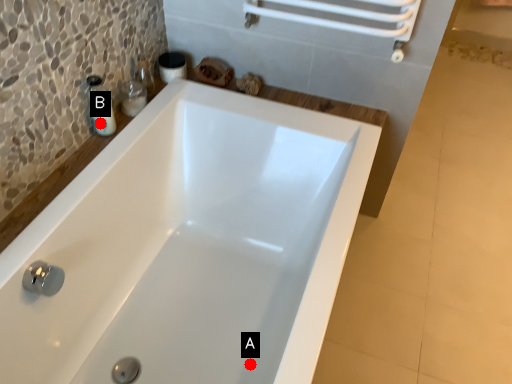
Question: Two points are circled on the image, labeled by A and B beside each circle. Which point appears farthest from the camera in this image?

Choices:
 (A) A is further
 (B) B is further

Answer: (B)